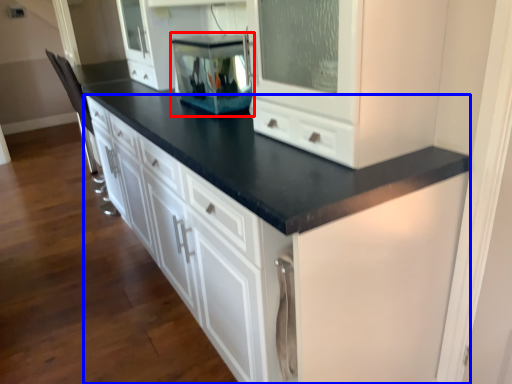
Question: Among these objects, which one is nearest to the camera, appliance (highlighted by a red box) or cabinetry (highlighted by a blue box)?

Choices:
 (A) appliance
 (B) cabinetry

Answer: (B)